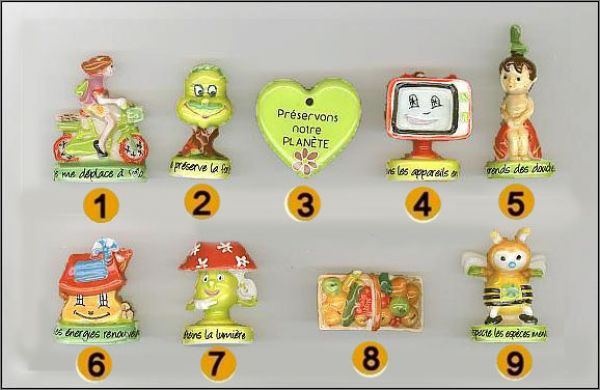
Where is `trinkets`? trinkets is located at coordinates (99, 124), (200, 121), (315, 132), (403, 114), (504, 113), (510, 261), (343, 295), (222, 297), (108, 299).